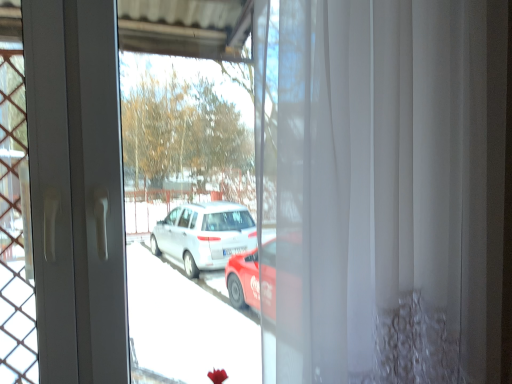
Describe the element at coordinates (402, 191) in the screenshot. I see `white sheer curtain at center` at that location.

This screenshot has height=384, width=512. I want to click on white sheer curtain at center, so click(402, 191).

In order to face transparent plastic curtain at right, should I rotate leftwards or rightwards?

To face it directly, rotate left by 13.484 degrees.

Where is `transparent plastic curtain at right`? transparent plastic curtain at right is located at coordinates (208, 100).

Describe the element at coordinates (208, 100) in the screenshot. This screenshot has width=512, height=384. I see `transparent plastic curtain at right` at that location.

Locate an element on the screen. The image size is (512, 384). white sheer curtain at center is located at coordinates (402, 191).

Between transparent plastic curtain at right and white sheer curtain at center, which one appears on the left side from the viewer's perspective?

From the viewer's perspective, transparent plastic curtain at right appears more on the left side.

Considering the positions of objects transparent plastic curtain at right and white sheer curtain at center in the image provided, who is in front, transparent plastic curtain at right or white sheer curtain at center?

white sheer curtain at center is more forward.

Considering the positions of point (132, 28) and point (337, 152), is point (132, 28) closer or farther from the camera than point (337, 152)?

Point (132, 28) is farther from the camera than point (337, 152).

From the image's perspective, is transparent plastic curtain at right above white sheer curtain at center?

Incorrect, from the image's perspective, transparent plastic curtain at right is lower than white sheer curtain at center.

Consider the image. From a real-world perspective, is transparent plastic curtain at right located beneath white sheer curtain at center?

Correct, in the physical world, transparent plastic curtain at right is lower than white sheer curtain at center.

Does transparent plastic curtain at right have a greater width compared to white sheer curtain at center?

In fact, transparent plastic curtain at right might be narrower than white sheer curtain at center.

Is transparent plastic curtain at right taller than white sheer curtain at center?

Indeed, transparent plastic curtain at right has a greater height compared to white sheer curtain at center.

Who is bigger, transparent plastic curtain at right or white sheer curtain at center?

white sheer curtain at center is bigger.

Is transparent plastic curtain at right situated inside white sheer curtain at center or outside?

transparent plastic curtain at right cannot be found inside white sheer curtain at center.

Is transparent plastic curtain at right with white sheer curtain at center?

No, transparent plastic curtain at right is not next to white sheer curtain at center.

Does transparent plastic curtain at right turn towards white sheer curtain at center?

No.

How many degrees apart are the facing directions of transparent plastic curtain at right and white sheer curtain at center?

They differ by 1.55 degrees in their facing directions.

How distant is transparent plastic curtain at right from white sheer curtain at center?

transparent plastic curtain at right is 20.40 inches away from white sheer curtain at center.

The image size is (512, 384). I want to click on shop window on the left of white sheer curtain at center, so click(x=208, y=100).

Considering the relative positions of white sheer curtain at center and transparent plastic curtain at right in the image provided, is white sheer curtain at center to the right of transparent plastic curtain at right from the viewer's perspective?

Yes, white sheer curtain at center is to the right of transparent plastic curtain at right.

Is the depth of white sheer curtain at center greater than that of transparent plastic curtain at right?

No.

Which is behind, point (350, 67) or point (260, 214)?

Positioned behind is point (350, 67).

From the image's perspective, is white sheer curtain at center located above transparent plastic curtain at right?

Yes, from the image's perspective, white sheer curtain at center is on top of transparent plastic curtain at right.

From a real-world perspective, is white sheer curtain at center positioned over transparent plastic curtain at right based on gravity?

Yes.

Which object is wider, white sheer curtain at center or transparent plastic curtain at right?

white sheer curtain at center is wider.

Is white sheer curtain at center taller than transparent plastic curtain at right?

No.

Looking at the image, does white sheer curtain at center seem bigger or smaller compared to transparent plastic curtain at right?

Considering their sizes, white sheer curtain at center takes up more space than transparent plastic curtain at right.

Is white sheer curtain at center not within transparent plastic curtain at right?

That's correct, white sheer curtain at center is outside of transparent plastic curtain at right.

Can you see white sheer curtain at center touching transparent plastic curtain at right?

white sheer curtain at center is not next to transparent plastic curtain at right, and they're not touching.

Is white sheer curtain at center turned away from transparent plastic curtain at right?

No, white sheer curtain at center is not facing the opposite direction of transparent plastic curtain at right.

Locate an element on the screen. Image resolution: width=512 pixels, height=384 pixels. curtain above the transparent plastic curtain at right (from a real-world perspective) is located at coordinates (402, 191).

In the image, there is a white sheer curtain at center. Identify the location of shop window below it (from the image's perspective). The height and width of the screenshot is (384, 512). (208, 100).

Locate an element on the screen. curtain in front of the transparent plastic curtain at right is located at coordinates (402, 191).